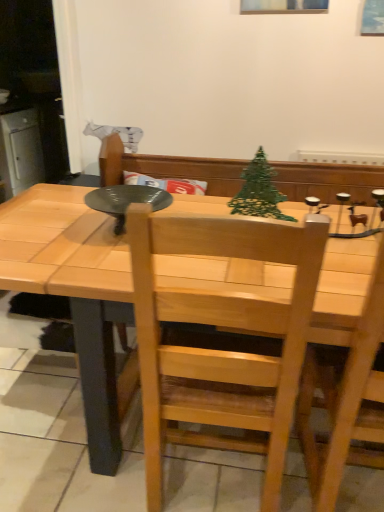
The width and height of the screenshot is (384, 512). I want to click on vacant area in front of green wire christmas tree at center, so click(243, 267).